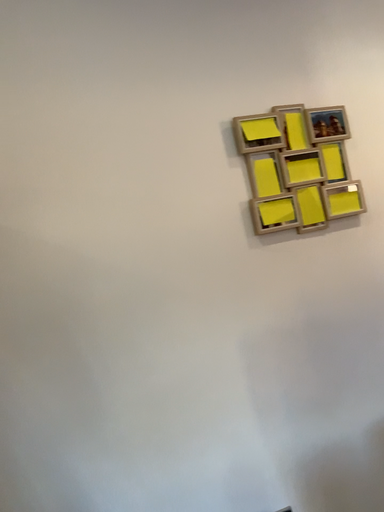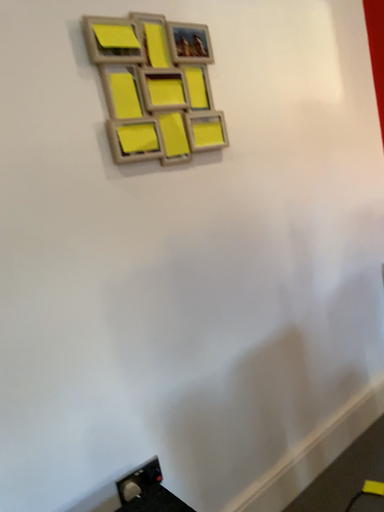
Question: Which way did the camera rotate in the video?

Choices:
 (A) rotated right
 (B) rotated left

Answer: (A)